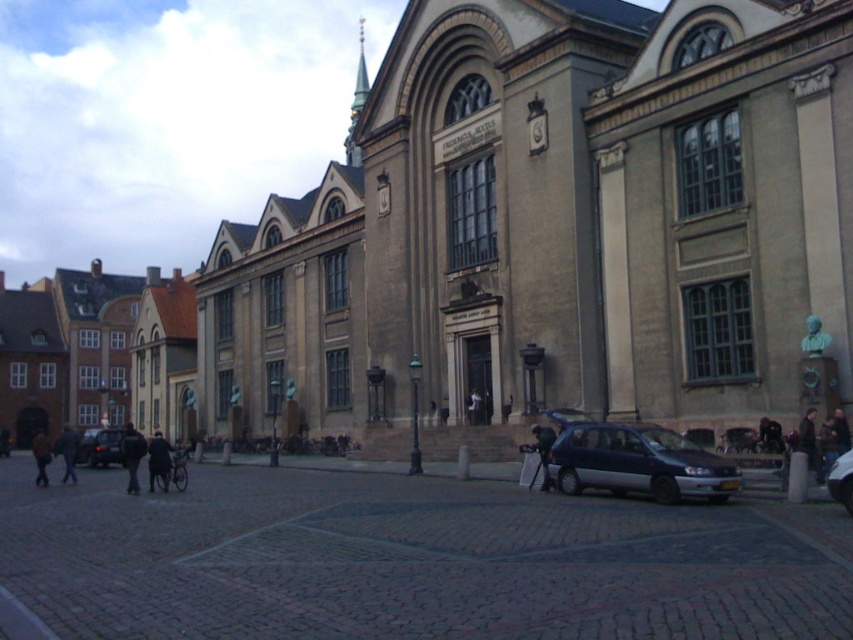
Question: Is beige stone church at center positioned before dark blue jeans at lower left?

Choices:
 (A) no
 (B) yes

Answer: (B)

Question: Is metallic silver car at lower right positioned behind dark blue coat at lower left?

Choices:
 (A) no
 (B) yes

Answer: (A)

Question: Is metallic silver car at lower right positioned behind dark blue jacket at center?

Choices:
 (A) no
 (B) yes

Answer: (A)

Question: Which point is farther from the camera taking this photo?

Choices:
 (A) (683, 461)
 (B) (552, 481)

Answer: (B)

Question: Which is nearer to the brown leather jacket at lower left?

Choices:
 (A) dark blue coat at lower left
 (B) dark blue jacket at center
 (C) metallic silver car at center
 (D) beige stone church at center

Answer: (C)

Question: Estimate the real-world distances between objects in this image. Which object is closer to the beige stone church at center?

Choices:
 (A) satin dark blue hatchback at lower center
 (B) dark blue jeans at lower left

Answer: (A)